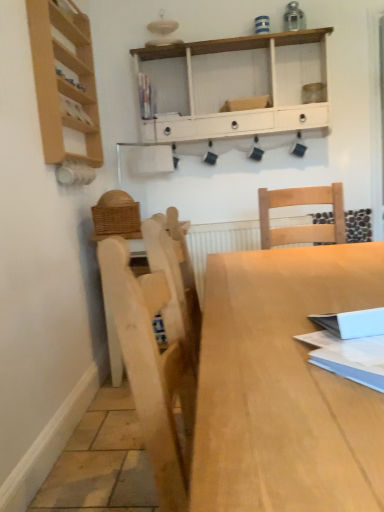
Question: Is the position of light wood shelf at left, which is the second shelf from back to front, more distant than that of matte plastic book at upper center, arranged as the 1th book when viewed from the top?

Choices:
 (A) yes
 (B) no

Answer: (B)

Question: Is light wood shelf at left, which appears as the first shelf when viewed from the left, smaller than matte plastic book at upper center, the 1th book when ordered from left to right?

Choices:
 (A) yes
 (B) no

Answer: (B)

Question: Is light wood shelf at left, which appears as the first shelf when viewed from the left, closer to camera compared to matte plastic book at upper center, which is counted as the second book, starting from the right?

Choices:
 (A) yes
 (B) no

Answer: (A)

Question: Is light wood shelf at left, arranged as the first shelf when viewed from the front, oriented towards matte plastic book at upper center, the 1th book when ordered from left to right?

Choices:
 (A) yes
 (B) no

Answer: (B)

Question: Considering the relative positions of light wood shelf at left, which appears as the first shelf when viewed from the left, and matte plastic book at upper center, marked as the 1th book in a back-to-front arrangement, in the image provided, is light wood shelf at left, which appears as the first shelf when viewed from the left, to the left of matte plastic book at upper center, marked as the 1th book in a back-to-front arrangement, from the viewer's perspective?

Choices:
 (A) yes
 (B) no

Answer: (A)

Question: Does light wood shelf at left, the second shelf positioned from the right, have a larger size compared to matte plastic book at upper center, arranged as the 1th book when viewed from the top?

Choices:
 (A) no
 (B) yes

Answer: (B)

Question: Is light wood shelf at left, the second shelf positioned from the right, inside light wood table at center?

Choices:
 (A) no
 (B) yes

Answer: (A)

Question: Is light wood table at center facing towards light wood shelf at left, arranged as the first shelf when viewed from the front?

Choices:
 (A) yes
 (B) no

Answer: (B)

Question: Is light wood table at center looking in the opposite direction of light wood shelf at left, which appears as the first shelf when viewed from the left?

Choices:
 (A) no
 (B) yes

Answer: (A)

Question: Is light wood table at center shorter than light wood shelf at left, the second shelf positioned from the right?

Choices:
 (A) no
 (B) yes

Answer: (B)

Question: Is light wood table at center smaller than light wood shelf at left, which appears as the first shelf when viewed from the left?

Choices:
 (A) no
 (B) yes

Answer: (A)

Question: Considering the relative sizes of light wood table at center and light wood shelf at left, which appears as the first shelf when viewed from the left, in the image provided, is light wood table at center wider than light wood shelf at left, which appears as the first shelf when viewed from the left,?

Choices:
 (A) yes
 (B) no

Answer: (A)

Question: From the image's perspective, is light wood table at center beneath matte plastic book at upper center, marked as the 1th book in a back-to-front arrangement?

Choices:
 (A) yes
 (B) no

Answer: (A)